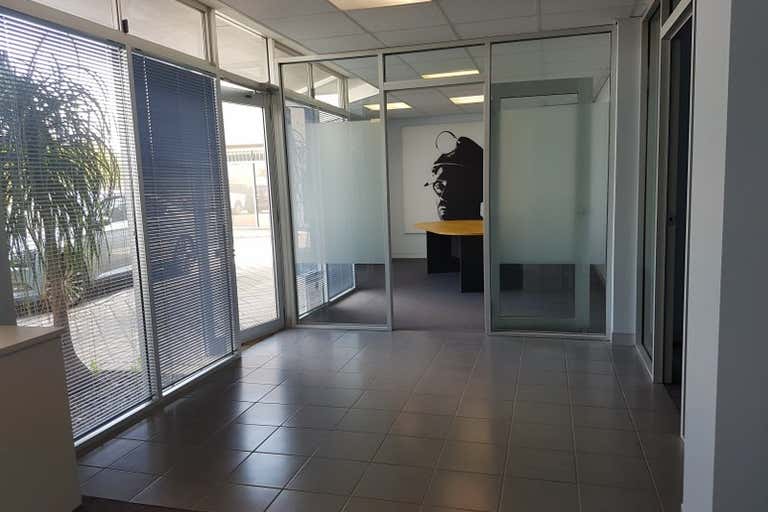
Locate an element on the screen. whiteboard is located at coordinates tap(415, 198).